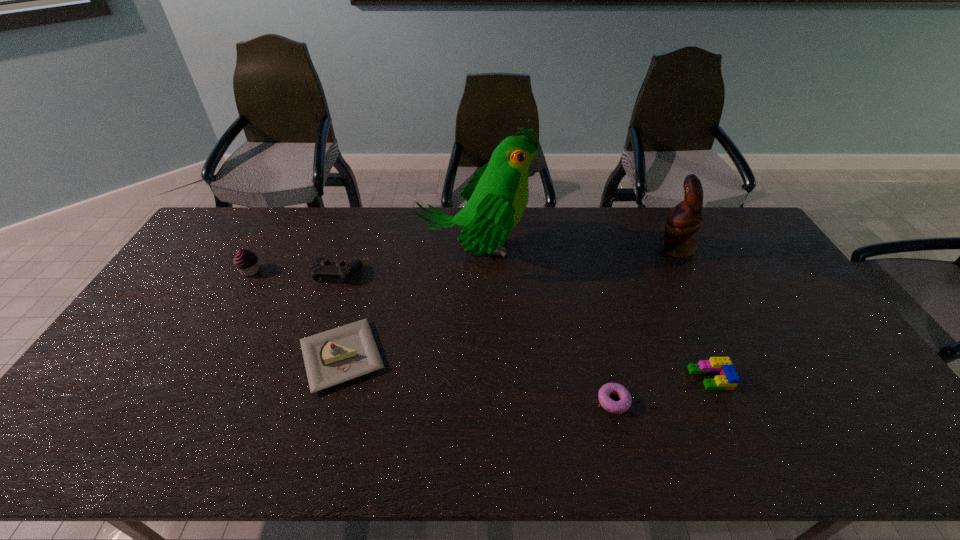
Image resolution: width=960 pixels, height=540 pixels. In order to click on vacant space located 0.180m on the beak of the parakeet in this screenshot , I will do `click(588, 249)`.

This screenshot has height=540, width=960. Identify the location of free space located 0.170m on the face of the parrot. (609, 248).

Identify the location of free space located on the face of the parrot. (626, 248).

Find the location of a particular element. This screenshot has width=960, height=540. vacant space situated 0.140m on the face of the parrot is located at coordinates click(617, 248).

At what (x,y) coordinates should I click in order to perform the action: click on free space located on the front of the leftmost object. Please return your answer as a coordinate pair (x, y). Looking at the image, I should click on pos(212,339).

The image size is (960, 540). I want to click on vacant space located 0.080m on the back of the control, so click(x=347, y=247).

The width and height of the screenshot is (960, 540). Find the location of `blank space located 0.360m on the right of the cake`. blank space located 0.360m on the right of the cake is located at coordinates (520, 356).

The image size is (960, 540). Identify the location of free region located on the back of the Lego. (692, 338).

You are a GUI agent. You are given a task and a screenshot of the screen. Output one action in this format:
    pyautogui.click(x=<x>, y=<y>)
    Task: Click on the free space located on the left of the third object from right to left
    Image resolution: width=960 pixels, height=540 pixels.
    Given the screenshot: What is the action you would take?
    pyautogui.click(x=504, y=401)

Find the location of a particular element. The image size is (960, 540). parakeet that is at the far edge is located at coordinates (497, 196).